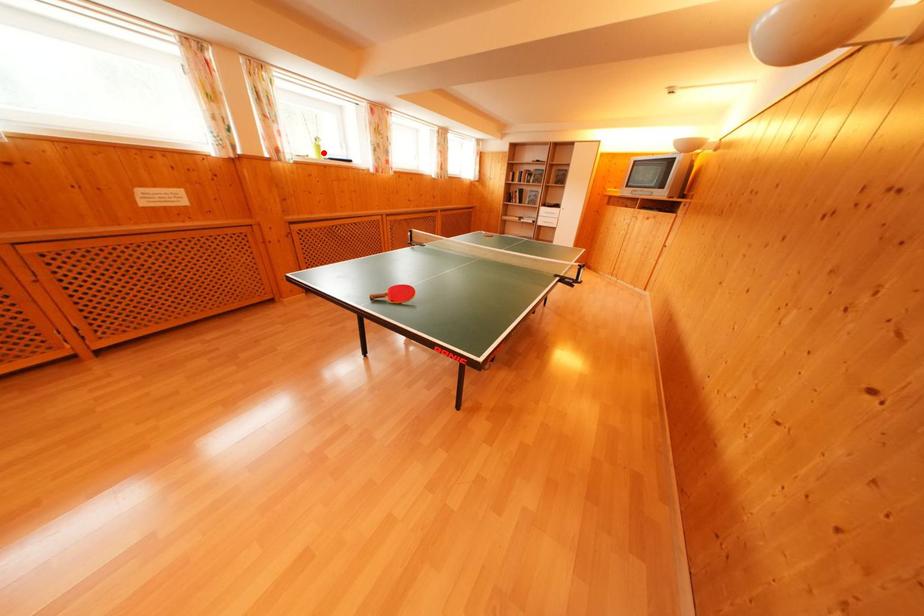
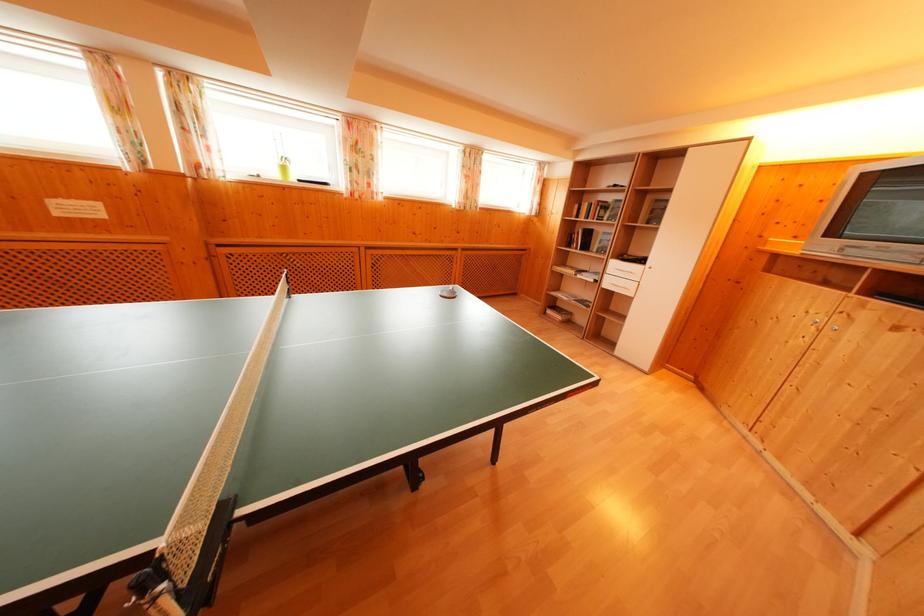
Where in the second image is the point corresponding to the highlighted location from the first image?

(288, 174)